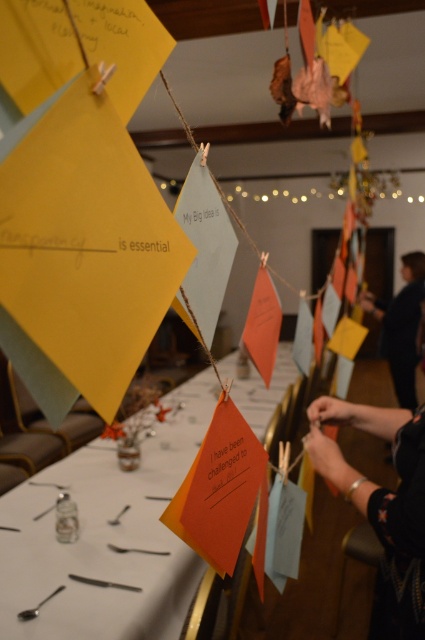
Question: Is black fabric hand at lower right smaller than dark blue fabric at upper right?

Choices:
 (A) yes
 (B) no

Answer: (A)

Question: In this image, where is orange paper tag at center located relative to black fabric hand at lower right?

Choices:
 (A) below
 (B) above

Answer: (A)

Question: Estimate the real-world distances between objects in this image. Which object is closer to the orange paper tag at center?

Choices:
 (A) dark blue fabric at upper right
 (B) black fabric hand at lower right

Answer: (B)

Question: Is black fabric hand at lower right to the left of dark blue fabric at upper right from the viewer's perspective?

Choices:
 (A) no
 (B) yes

Answer: (B)

Question: Which object is farther from the camera taking this photo?

Choices:
 (A) black fabric hand at lower right
 (B) orange paper tag at center
 (C) dark blue fabric at upper right

Answer: (C)

Question: Considering the real-world distances, which object is farthest from the orange paper tag at center?

Choices:
 (A) black fabric hand at lower right
 (B) dark blue fabric at upper right

Answer: (B)